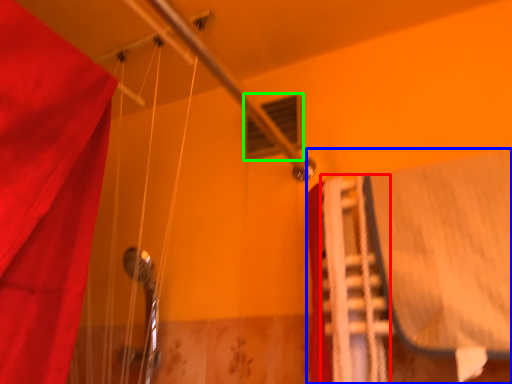
Question: Estimate the real-world distances between objects in this image. Which object is farther from stair (highlighted by a red box), bed (highlighted by a blue box) or window (highlighted by a green box)?

Choices:
 (A) bed
 (B) window

Answer: (B)